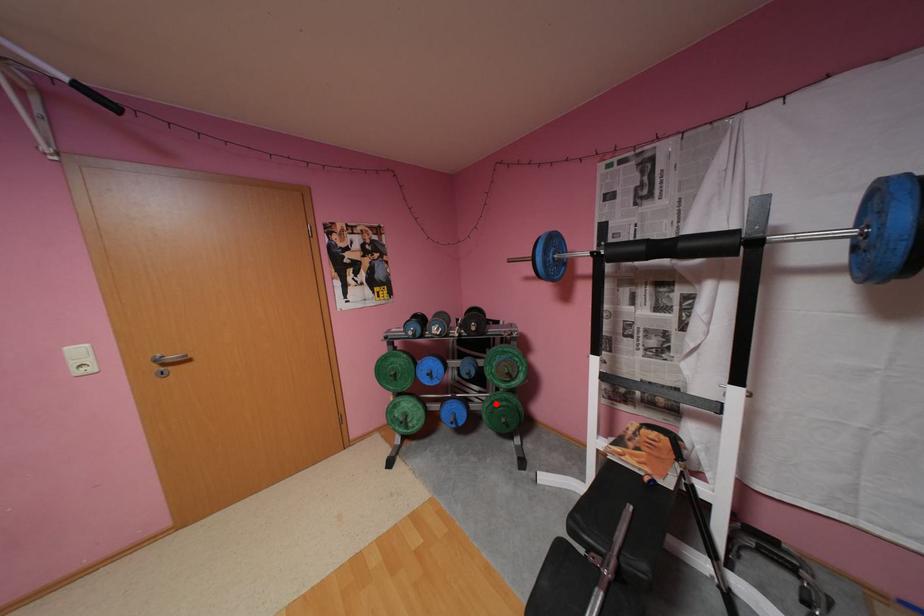
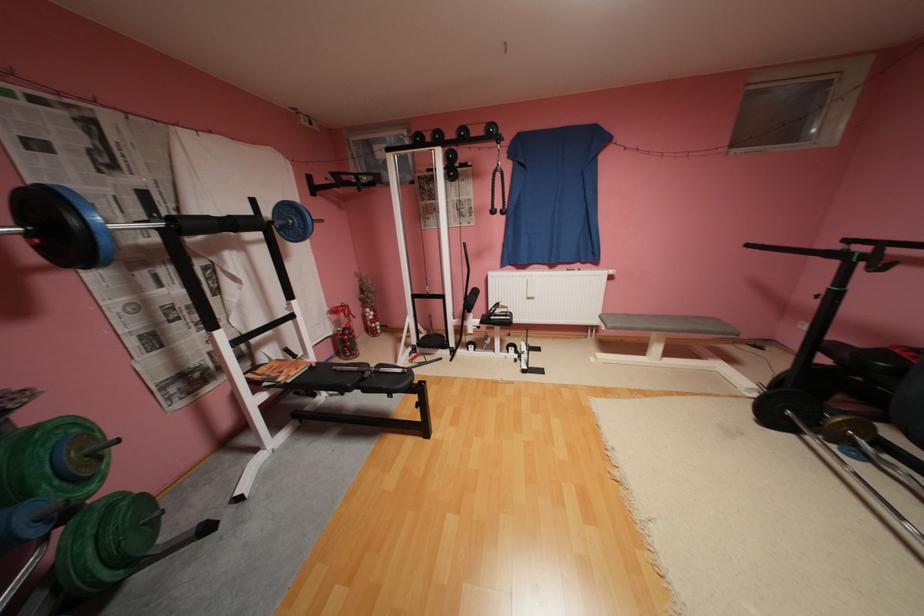
The point at the highlighted location is marked in the first image. Where is the corresponding point in the second image?

(100, 551)